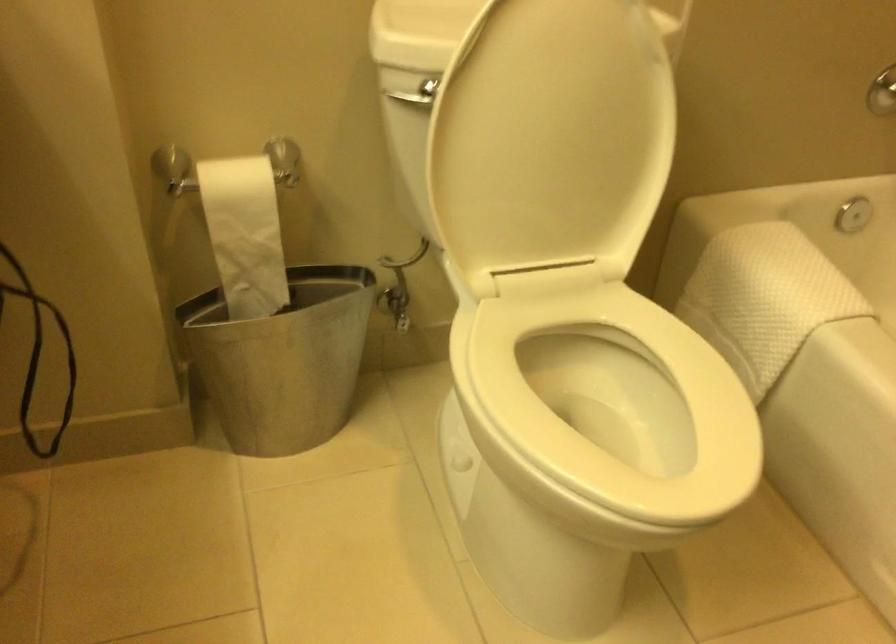
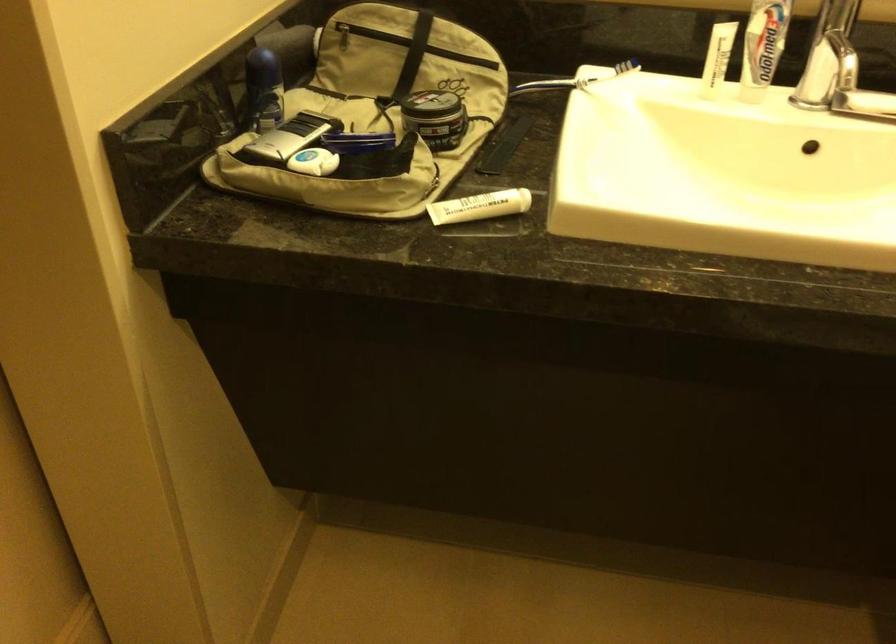
How did the camera likely rotate?

The rotation direction of the camera is left-down.